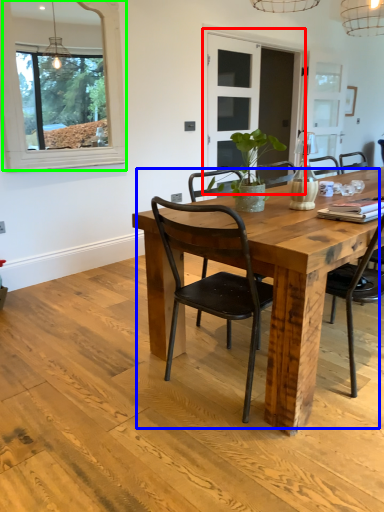
Question: Which object is the farthest from glass door (highlighted by a red box)? Choose among these: kitchen & dining room table (highlighted by a blue box) or window (highlighted by a green box).

Choices:
 (A) kitchen & dining room table
 (B) window

Answer: (A)